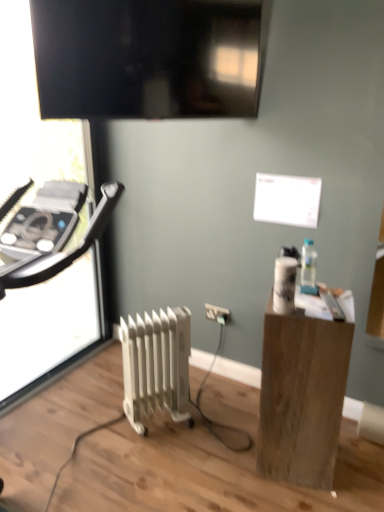
Question: Is wooden block at right at the right side of white metallic radiator at center?

Choices:
 (A) yes
 (B) no

Answer: (A)

Question: From the image's perspective, is wooden block at right located beneath white metallic radiator at center?

Choices:
 (A) yes
 (B) no

Answer: (B)

Question: Is wooden block at right taller than white metallic radiator at center?

Choices:
 (A) no
 (B) yes

Answer: (B)

Question: Is wooden block at right positioned behind white metallic radiator at center?

Choices:
 (A) no
 (B) yes

Answer: (A)

Question: Does wooden block at right have a lesser height compared to white metallic radiator at center?

Choices:
 (A) no
 (B) yes

Answer: (A)

Question: Does wooden block at right come in front of white metallic radiator at center?

Choices:
 (A) yes
 (B) no

Answer: (A)

Question: Is white metallic radiator at center far from clear glass bottle at right?

Choices:
 (A) no
 (B) yes

Answer: (A)

Question: Is the position of white metallic radiator at center less distant than that of clear glass bottle at right?

Choices:
 (A) no
 (B) yes

Answer: (A)

Question: Does white metallic radiator at center have a greater height compared to clear glass bottle at right?

Choices:
 (A) no
 (B) yes

Answer: (B)

Question: Does white metallic radiator at center appear on the right side of clear glass bottle at right?

Choices:
 (A) no
 (B) yes

Answer: (A)

Question: Considering the relative sizes of white metallic radiator at center and clear glass bottle at right in the image provided, is white metallic radiator at center wider than clear glass bottle at right?

Choices:
 (A) no
 (B) yes

Answer: (B)

Question: Could clear glass bottle at right be considered to be inside white metallic radiator at center?

Choices:
 (A) yes
 (B) no

Answer: (B)

Question: Is matte black tv at upper center positioned with its back to wooden block at right?

Choices:
 (A) yes
 (B) no

Answer: (B)